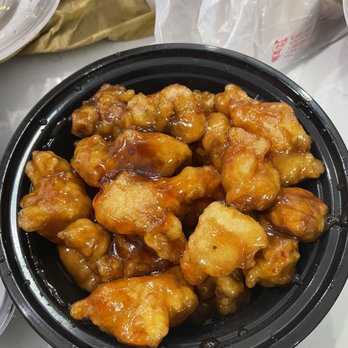
Locate an element on the screen. The height and width of the screenshot is (348, 348). table is located at coordinates (48, 64).